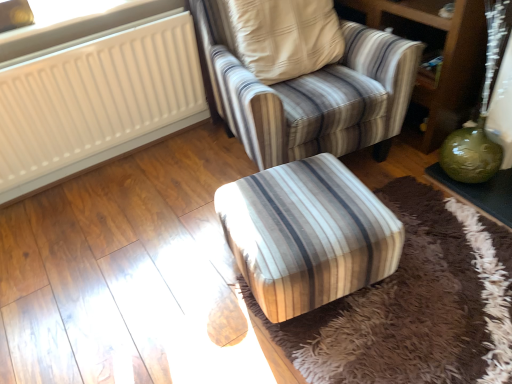
Question: Which is correct: white plastic radiator at upper left is inside striped fabric armchair at center, or outside of it?

Choices:
 (A) inside
 (B) outside

Answer: (B)

Question: Is white plastic radiator at upper left in front of or behind striped fabric armchair at center in the image?

Choices:
 (A) front
 (B) behind

Answer: (B)

Question: Estimate the real-world distances between objects in this image. Which object is farther from the striped fabric armchair at center?

Choices:
 (A) green glossy vase at lower right
 (B) green glass vase at right
 (C) green glossy vase at right
 (D) white plastic radiator at upper left
 (E) white matte radiator at upper left

Answer: (D)

Question: Considering the real-world distances, which object is farthest from the green glossy vase at lower right?

Choices:
 (A) white plastic radiator at upper left
 (B) striped fabric armchair at center
 (C) white matte radiator at upper left
 (D) green glass vase at right
 (E) green glossy vase at right

Answer: (A)